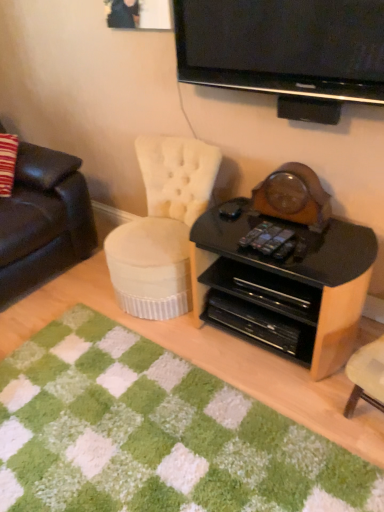
Question: Based on their positions, is white tufted fabric chair at center located to the left or right of black glossy television at upper center?

Choices:
 (A) left
 (B) right

Answer: (A)

Question: Considering their positions, is white tufted fabric chair at center located in front of or behind black glossy television at upper center?

Choices:
 (A) front
 (B) behind

Answer: (B)

Question: Which object is positioned closest to the black plastic remote control at center?

Choices:
 (A) white tufted fabric chair at center
 (B) black plastic drawer at center
 (C) black glossy television at upper center
 (D) black glossy desk at center
 (E) green shaggy rug at lower center

Answer: (B)

Question: Estimate the real-world distances between objects in this image. Which object is farther from the leather couch at left?

Choices:
 (A) green shaggy rug at lower center
 (B) black glossy television at upper center
 (C) black plastic remote control at center
 (D) white tufted fabric chair at center
 (E) black glossy desk at center

Answer: (C)